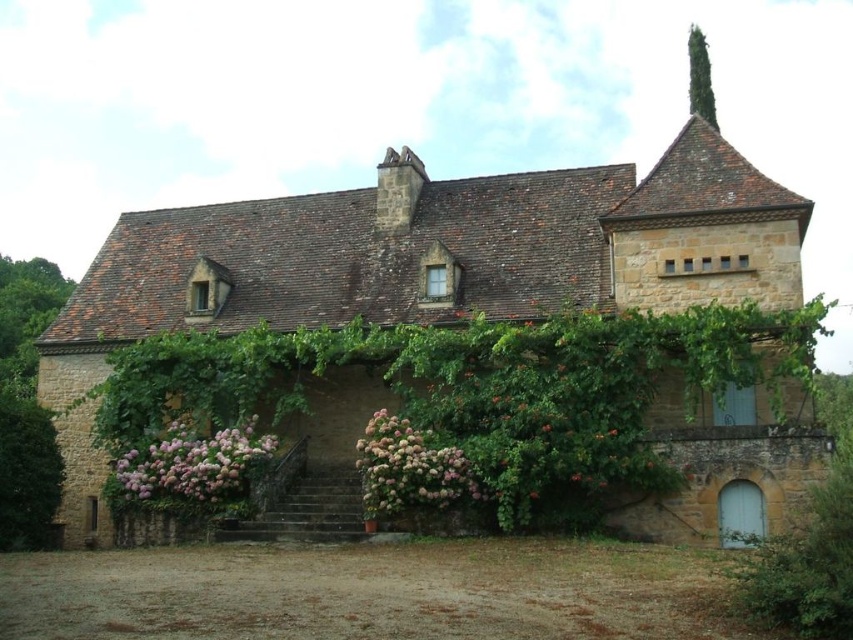
Question: Does brown stone cottage at center appear under pink matte hydrangea at center?

Choices:
 (A) no
 (B) yes

Answer: (A)

Question: Which is farther from the pink fluffy flowers at lower left?

Choices:
 (A) pink matte hydrangea at center
 (B) brown stone cottage at center

Answer: (B)

Question: Can you confirm if brown stone cottage at center is bigger than pink matte hydrangea at center?

Choices:
 (A) yes
 (B) no

Answer: (A)

Question: Can you confirm if brown stone cottage at center is positioned above pink matte hydrangea at center?

Choices:
 (A) yes
 (B) no

Answer: (A)

Question: Which object is positioned farthest from the pink fluffy flowers at lower left?

Choices:
 (A) brown stone cottage at center
 (B) pink matte hydrangea at center

Answer: (A)

Question: Which of the following is the closest to the observer?

Choices:
 (A) (596, 214)
 (B) (178, 452)
 (C) (369, 461)

Answer: (C)